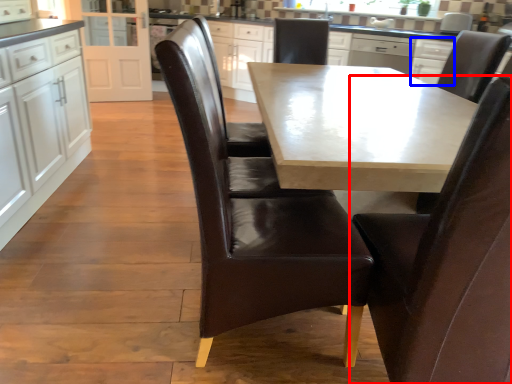
Question: Which point is closer to the camera, chair (highlighted by a red box) or cabinetry (highlighted by a blue box)?

Choices:
 (A) chair
 (B) cabinetry

Answer: (A)